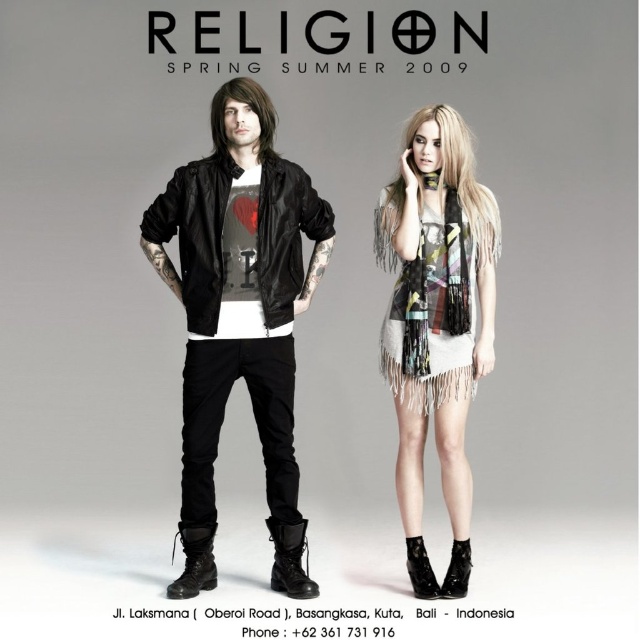
Does matte black bomber jacket at center appear on the right side of printed chiffon dress at center?

Incorrect, matte black bomber jacket at center is not on the right side of printed chiffon dress at center.

Is point (214, 282) in front of point (400, 280)?

Yes, it is in front of point (400, 280).

Where is `matte black bomber jacket at center`? matte black bomber jacket at center is located at coordinates (240, 316).

Is fringed scarf at center to the right of printed chiffon dress at center from the viewer's perspective?

Yes, fringed scarf at center is to the right of printed chiffon dress at center.

Does fringed scarf at center have a lesser height compared to printed chiffon dress at center?

Incorrect, fringed scarf at center's height does not fall short of printed chiffon dress at center's.

Is point (419, 372) less distant than point (438, 358)?

No.

Where is `fringed scarf at center`? fringed scarf at center is located at coordinates (436, 323).

Between matte black bomber jacket at center and fringed scarf at center, which one is positioned lower?

fringed scarf at center is lower down.

Is matte black bomber jacket at center taller than fringed scarf at center?

Yes, matte black bomber jacket at center is taller than fringed scarf at center.

Which is in front, point (234, 147) or point (404, 374)?

Point (234, 147) is in front.

You are a GUI agent. You are given a task and a screenshot of the screen. Output one action in this format:
    pyautogui.click(x=<x>, y=<y>)
    Task: Click on the matte black bomber jacket at center
    
    Given the screenshot: What is the action you would take?
    pyautogui.click(x=240, y=316)